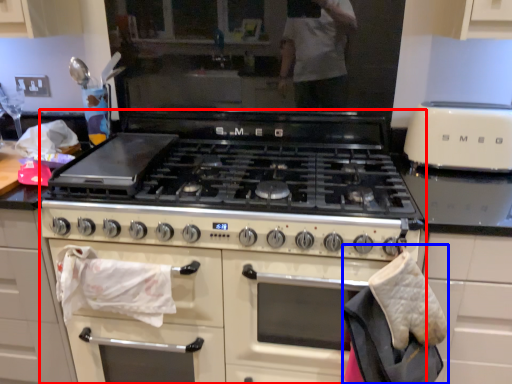
Question: Which point is further to the camera, appliance (highlighted by a red box) or material (highlighted by a blue box)?

Choices:
 (A) appliance
 (B) material

Answer: (A)